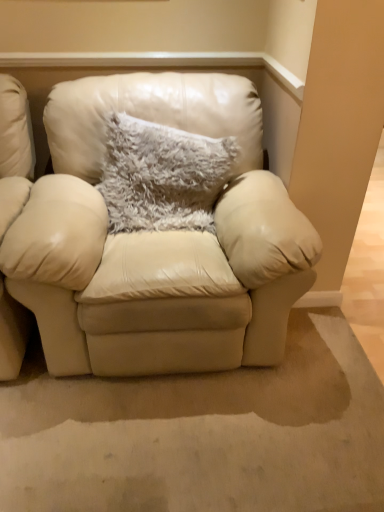
Question: Considering the relative sizes of matte cream leather armchair at center and fuzzy gray pillow at center in the image provided, is matte cream leather armchair at center wider than fuzzy gray pillow at center?

Choices:
 (A) yes
 (B) no

Answer: (A)

Question: Is matte cream leather armchair at center far away from fuzzy gray pillow at center?

Choices:
 (A) yes
 (B) no

Answer: (B)

Question: Does matte cream leather armchair at center turn towards fuzzy gray pillow at center?

Choices:
 (A) no
 (B) yes

Answer: (B)

Question: Considering the relative sizes of matte cream leather armchair at center and fuzzy gray pillow at center in the image provided, is matte cream leather armchair at center thinner than fuzzy gray pillow at center?

Choices:
 (A) no
 (B) yes

Answer: (A)

Question: Considering the relative positions of matte cream leather armchair at center and fuzzy gray pillow at center in the image provided, is matte cream leather armchair at center in front of fuzzy gray pillow at center?

Choices:
 (A) yes
 (B) no

Answer: (A)

Question: Is fuzzy gray pillow at center a part of matte cream leather armchair at center?

Choices:
 (A) no
 (B) yes

Answer: (B)

Question: Is beige leather chair at left closer to the viewer compared to fuzzy gray pillow at center?

Choices:
 (A) no
 (B) yes

Answer: (B)

Question: Considering the relative sizes of beige leather chair at left and fuzzy gray pillow at center in the image provided, is beige leather chair at left shorter than fuzzy gray pillow at center?

Choices:
 (A) yes
 (B) no

Answer: (B)

Question: Can you confirm if beige leather chair at left is bigger than fuzzy gray pillow at center?

Choices:
 (A) yes
 (B) no

Answer: (A)

Question: Can you confirm if beige leather chair at left is thinner than fuzzy gray pillow at center?

Choices:
 (A) no
 (B) yes

Answer: (A)

Question: Is beige leather chair at left looking in the opposite direction of fuzzy gray pillow at center?

Choices:
 (A) yes
 (B) no

Answer: (B)

Question: Would you say beige leather chair at left contains fuzzy gray pillow at center?

Choices:
 (A) no
 (B) yes

Answer: (A)

Question: Is fuzzy gray pillow at center outside matte cream leather armchair at center?

Choices:
 (A) yes
 (B) no

Answer: (B)